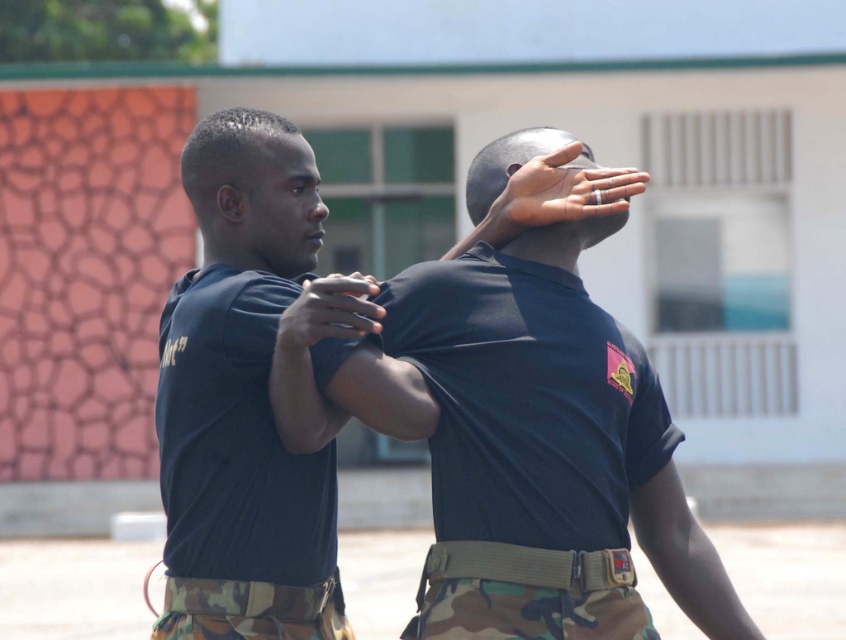
Between navy blue t-shirt at center and silver metallic ring at upper center, which one appears on the right side from the viewer's perspective?

silver metallic ring at upper center is more to the right.

Consider the image. Is navy blue t-shirt at center wider than silver metallic ring at upper center?

Yes, navy blue t-shirt at center is wider than silver metallic ring at upper center.

You are a GUI agent. You are given a task and a screenshot of the screen. Output one action in this format:
    pyautogui.click(x=<x>, y=<y>)
    Task: Click on the navy blue t-shirt at center
    
    Given the screenshot: What is the action you would take?
    pyautogui.click(x=237, y=474)

Who is more forward, (x=210, y=582) or (x=218, y=611)?

Point (x=210, y=582) is in front.

Locate an element on the screen. This screenshot has height=640, width=846. navy blue t-shirt at center is located at coordinates (237, 474).

Can you confirm if camo fabric belt at lower center is bigger than silver metallic ring at upper center?

No.

Can you confirm if camo fabric belt at lower center is positioned to the left of silver metallic ring at upper center?

Correct, you'll find camo fabric belt at lower center to the left of silver metallic ring at upper center.

Between point (319, 598) and point (552, 166), which one is positioned in front?

Point (319, 598)

You are a GUI agent. You are given a task and a screenshot of the screen. Output one action in this format:
    pyautogui.click(x=<x>, y=<y>)
    Task: Click on the camo fabric belt at lower center
    
    Given the screenshot: What is the action you would take?
    pyautogui.click(x=250, y=611)